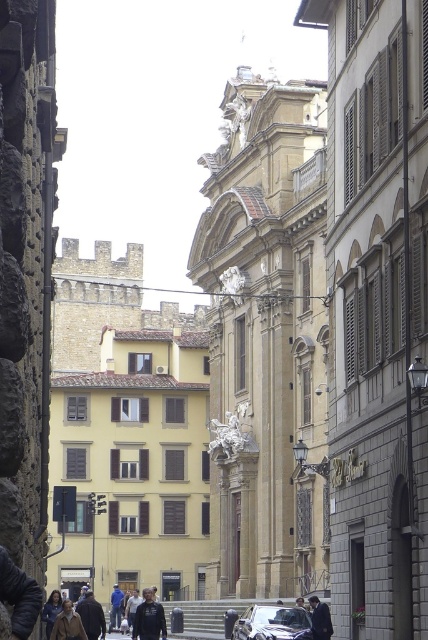
You are a tourist in this historic city and you want to take a photo of both the brown leather jacket at lower left and the dark gray suit at center. However, you notice that one is blocking the other. Which one should you move to get a clear shot of both?

The brown leather jacket at lower left is in front of the dark gray suit at center, so you should move the brown leather jacket at lower left to get a clear shot of both.

You are standing on the narrow street in front of the Hotel Grand. You see a brown leather jacket at lower left. If you want to pick it up, which direction should you move relative to your current position?

The brown leather jacket at lower left is located at point [68,624], which is to the lower left direction from your current position. Move towards the lower left to reach it.

You are a tourist in this historic city and you see a brown leather jacket at lower left and a dark gray suit at center. Which clothing item is closer to the left side of the street?

The brown leather jacket at lower left is closer to the left side of the street because it is positioned on the left side of the dark gray suit at center.